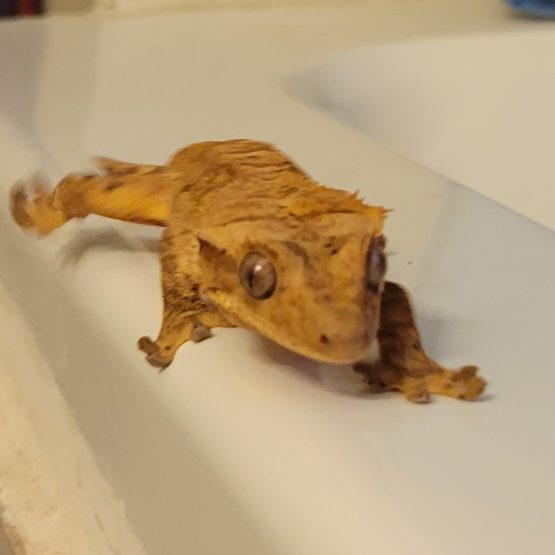
Where is `leg front leg`? This screenshot has width=555, height=555. leg front leg is located at coordinates (398, 350).